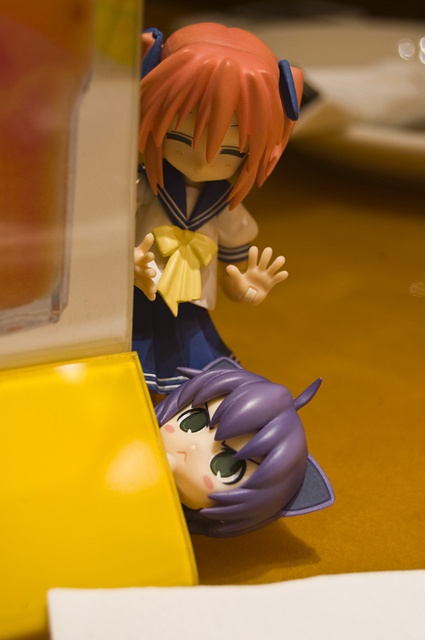
Is the position of satin yellow ribbon at center more distant than that of purple glossy figurine at lower center?

Yes, satin yellow ribbon at center is further from the viewer.

Does point (192, 356) come closer to viewer compared to point (200, 385)?

No, (192, 356) is behind (200, 385).

Who is more forward, [161,131] or [200,465]?

Point [200,465]

Identify the location of satin yellow ribbon at center. (203, 186).